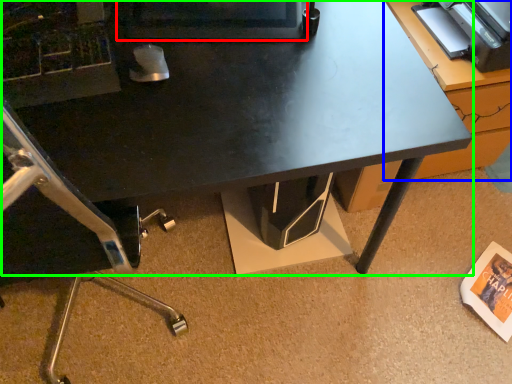
Question: Which is nearer to the computer monitor (highlighted by a red box)? table (highlighted by a blue box) or desk (highlighted by a green box).

Choices:
 (A) table
 (B) desk

Answer: (B)